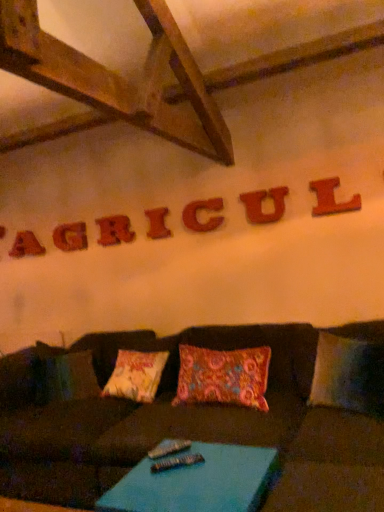
Identify the location of vacant area that is in front of metallic silver remote at center. The height and width of the screenshot is (512, 384). (168, 476).